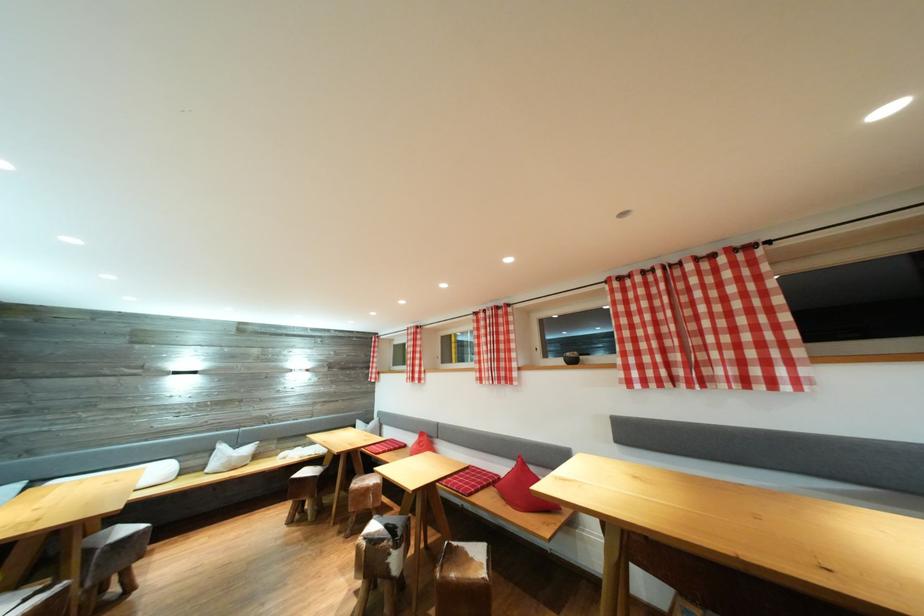
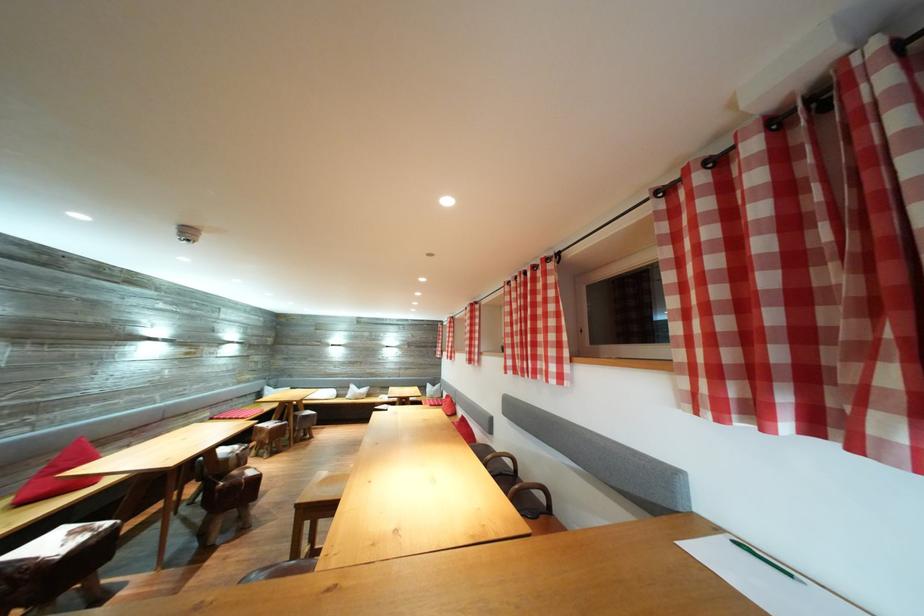
Where in the second image is the point corresponding to point 505,374 from the first image?

(477, 359)